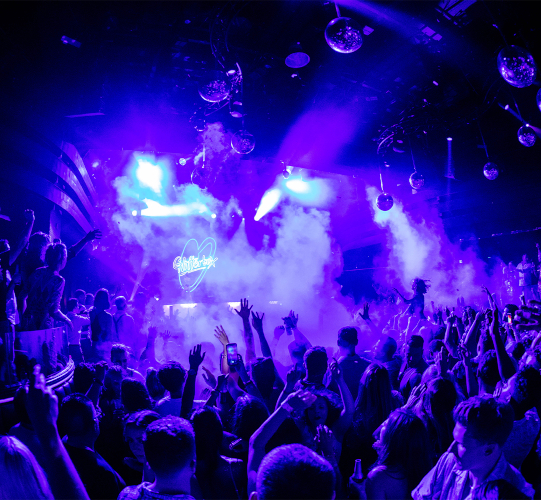
The image size is (541, 500). Find the location of `ceiling`. ceiling is located at coordinates (448, 83).